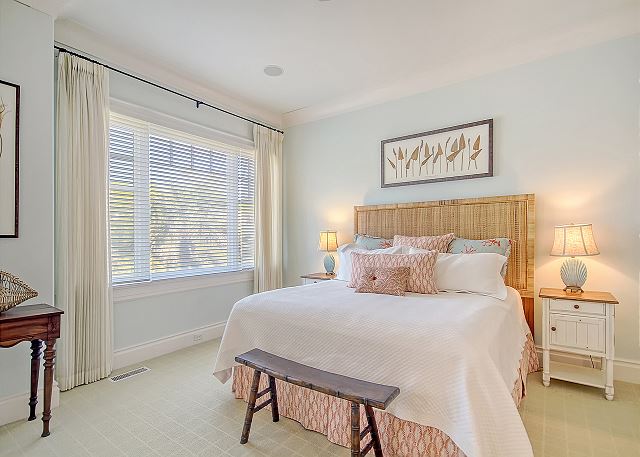
The width and height of the screenshot is (640, 457). In order to click on bench legs in this screenshot , I will do `click(354, 440)`, `click(369, 434)`, `click(276, 405)`, `click(244, 421)`.